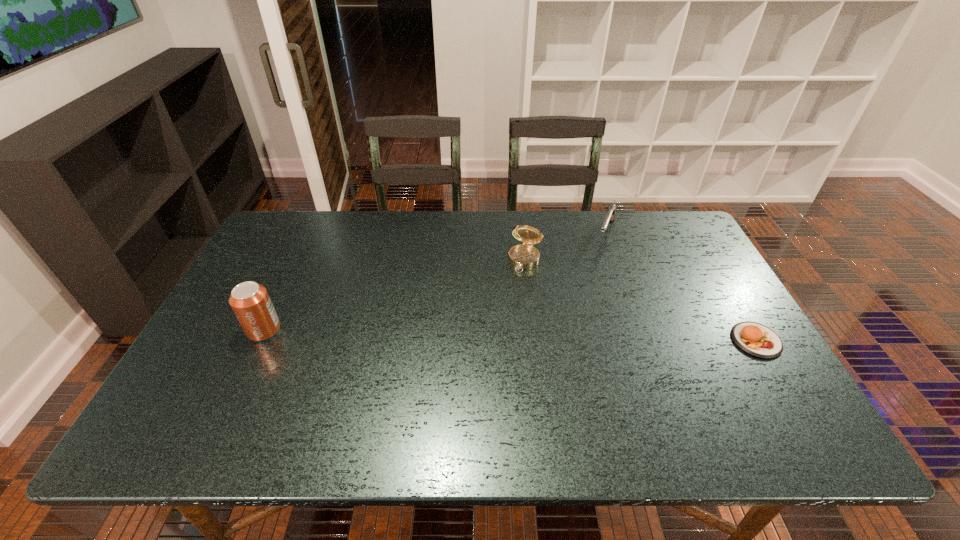
In the image, there is a desktop. Where is `vacant space at the far edge`? The image size is (960, 540). vacant space at the far edge is located at coordinates (454, 215).

This screenshot has height=540, width=960. I want to click on vacant region at the near edge of the desktop, so click(x=570, y=402).

Locate an element on the screen. free space at the right edge of the desktop is located at coordinates (708, 300).

I want to click on vacant area at the far left corner of the desktop, so click(x=286, y=219).

This screenshot has height=540, width=960. In order to click on blank space at the near left corner in this screenshot , I will do `click(220, 381)`.

Locate an element on the screen. vacant region at the far right corner of the desktop is located at coordinates (679, 233).

You are a GUI agent. You are given a task and a screenshot of the screen. Output one action in this format:
    pyautogui.click(x=<x>, y=<y>)
    Task: Click on the vacant point located between the third object from left to right and the tallest object
    This screenshot has width=960, height=540.
    Given the screenshot: What is the action you would take?
    pyautogui.click(x=435, y=281)

Locate an element on the screen. Image resolution: width=960 pixels, height=540 pixels. vacant area that lies between the third tallest object and the tallest object is located at coordinates (435, 281).

I want to click on free space that is in between the can and the third tallest object, so click(x=435, y=281).

The image size is (960, 540). What are the coordinates of `free space between the shortest object and the third object from right to left` in the screenshot? It's located at (640, 300).